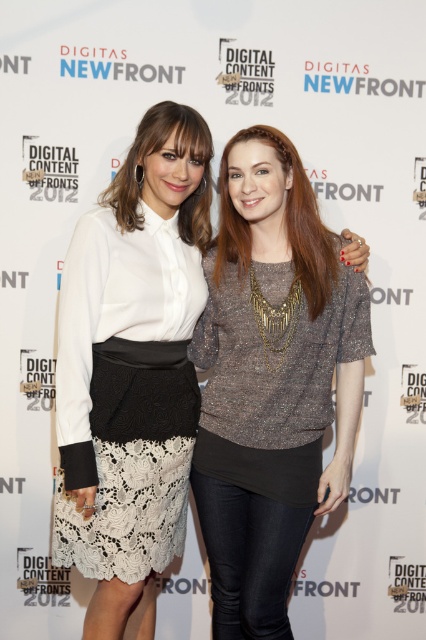
Question: Which point is closer to the camera taking this photo?

Choices:
 (A) (305, 392)
 (B) (68, 512)

Answer: (B)

Question: Among these points, which one is nearest to the camera?

Choices:
 (A) (175, 228)
 (B) (239, 576)

Answer: (A)

Question: Which point is farther to the camera?

Choices:
 (A) (331, 481)
 (B) (100, 356)

Answer: (A)

Question: Is sparkly metallic top at center thinner than white lace skirt at center?

Choices:
 (A) no
 (B) yes

Answer: (A)

Question: Can you confirm if sparkly metallic top at center is thinner than white lace skirt at center?

Choices:
 (A) yes
 (B) no

Answer: (B)

Question: Is sparkly metallic top at center wider than white lace skirt at center?

Choices:
 (A) yes
 (B) no

Answer: (A)